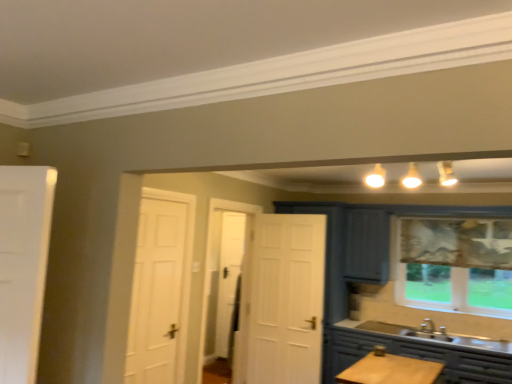
Question: Should I look upward or downward to see transparent fabric window at right?

Choices:
 (A) down
 (B) up

Answer: (A)

Question: Can you see transparent fabric window at right touching matte gray cabinet at lower right?

Choices:
 (A) yes
 (B) no

Answer: (B)

Question: Can you confirm if transparent fabric window at right is positioned to the left of matte gray cabinet at lower right?

Choices:
 (A) yes
 (B) no

Answer: (B)

Question: From a real-world perspective, is transparent fabric window at right under matte gray cabinet at lower right?

Choices:
 (A) no
 (B) yes

Answer: (A)

Question: Does transparent fabric window at right have a greater width compared to matte gray cabinet at lower right?

Choices:
 (A) yes
 (B) no

Answer: (B)

Question: Is the position of transparent fabric window at right more distant than that of matte gray cabinet at lower right?

Choices:
 (A) no
 (B) yes

Answer: (B)

Question: Considering the relative sizes of transparent fabric window at right and matte gray cabinet at lower right in the image provided, is transparent fabric window at right smaller than matte gray cabinet at lower right?

Choices:
 (A) yes
 (B) no

Answer: (A)

Question: Does matte gray cabinet at lower right have a larger size compared to transparent fabric window at right?

Choices:
 (A) yes
 (B) no

Answer: (A)

Question: Is matte gray cabinet at lower right touching transparent fabric window at right?

Choices:
 (A) yes
 (B) no

Answer: (B)

Question: From a real-world perspective, is matte gray cabinet at lower right located beneath transparent fabric window at right?

Choices:
 (A) yes
 (B) no

Answer: (A)

Question: From the image's perspective, is matte gray cabinet at lower right over transparent fabric window at right?

Choices:
 (A) no
 (B) yes

Answer: (A)

Question: Is transparent fabric window at right at the back of matte gray cabinet at lower right?

Choices:
 (A) no
 (B) yes

Answer: (A)

Question: From a real-world perspective, does matte gray cabinet at lower right stand above transparent fabric window at right?

Choices:
 (A) yes
 (B) no

Answer: (B)

Question: In terms of size, does transparent fabric window at right appear bigger or smaller than matte gray cabinet at lower right?

Choices:
 (A) big
 (B) small

Answer: (B)